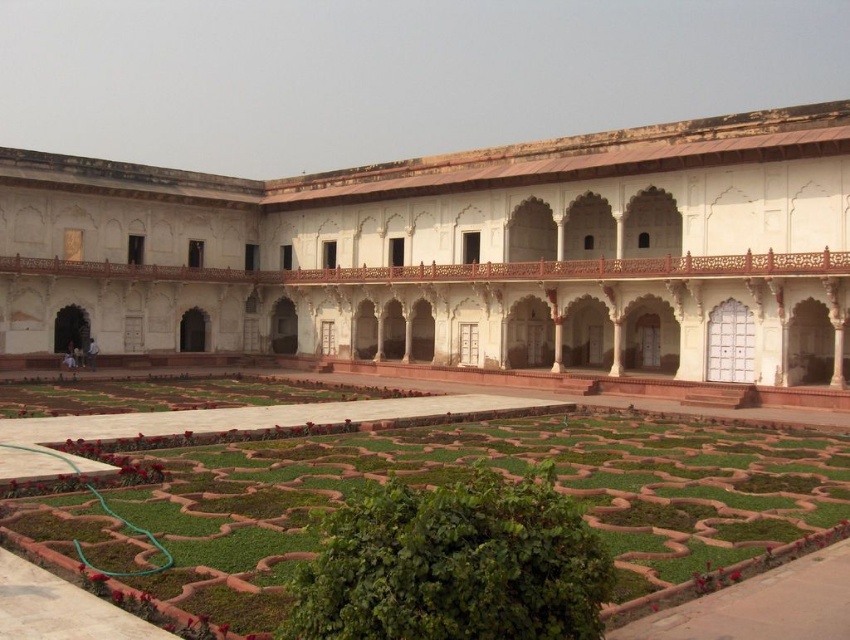
You are standing in the garden and want to take a photo of the white marble palace at center and the green grass at center. Which object should you focus on first to ensure both are in frame?

You should focus on the white marble palace at center first because it is closer to you than the green grass at center, so adjusting the camera to include both would require ensuring the palace is centered and the grass remains in the background within the frame.

You are standing in the garden in front of the historical building. You see two points marked in the image. Which point is closer to the building? The two points are located at coordinates point (314, 307) and point (75, 484).

Point (75, 484) is closer to the building because it is in front of point (314, 307).